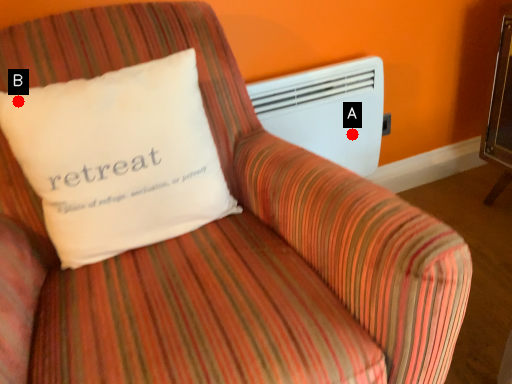
Question: Two points are circled on the image, labeled by A and B beside each circle. Which of the following is the farthest from the observer?

Choices:
 (A) A is further
 (B) B is further

Answer: (A)